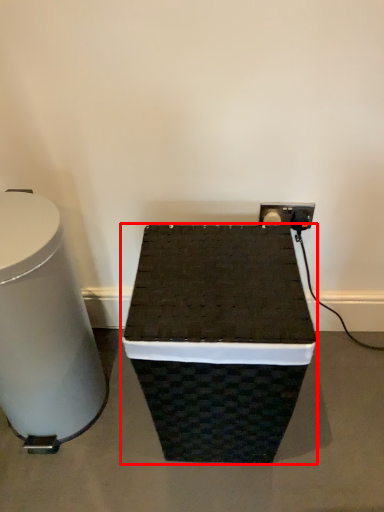
Question: In this image, where is furniture (annotated by the red box) located relative to table?

Choices:
 (A) left
 (B) right

Answer: (B)